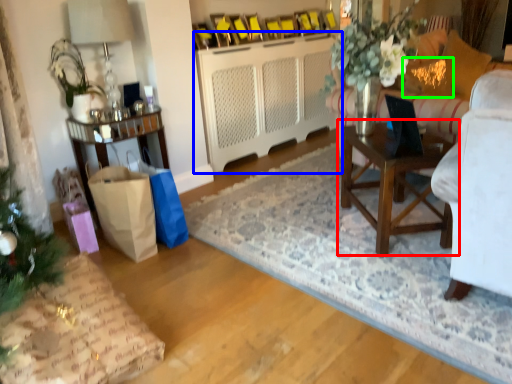
Question: Estimate the real-world distances between objects in this image. Which object is farther from table (highlighted by a red box), cabinetry (highlighted by a blue box) or pillow (highlighted by a green box)?

Choices:
 (A) cabinetry
 (B) pillow

Answer: (A)